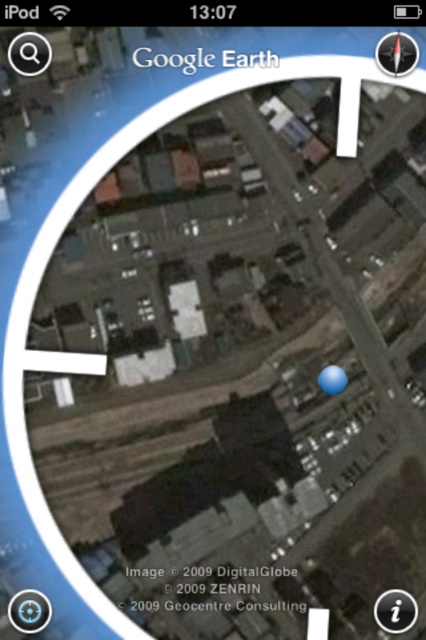
Between transparent blue circle at center and transparent glass circle at upper left, which one appears on the right side from the viewer's perspective?

Positioned to the right is transparent blue circle at center.

Can you confirm if transparent blue circle at center is bigger than transparent glass circle at upper left?

Indeed, transparent blue circle at center has a larger size compared to transparent glass circle at upper left.

Is point (405, 604) behind point (34, 49)?

That is True.

Where is `transparent blue circle at center`? transparent blue circle at center is located at coordinates (394, 611).

Between transparent blue circle at center and matte compass at upper right, which one is positioned lower?

transparent blue circle at center is lower down.

Between transparent blue circle at center and matte compass at upper right, which one has less height?

matte compass at upper right

Looking at this image, who is more distant from viewer, (x=391, y=588) or (x=409, y=64)?

The point (x=391, y=588) is behind.

Locate an element on the screen. This screenshot has height=640, width=426. transparent blue circle at center is located at coordinates (394, 611).

Does white paper at center have a lesser width compared to transparent blue circle at center?

No, white paper at center is not thinner than transparent blue circle at center.

Who is more forward, [147,60] or [391,630]?

Point [147,60] is more forward.

I want to click on white paper at center, so click(173, 60).